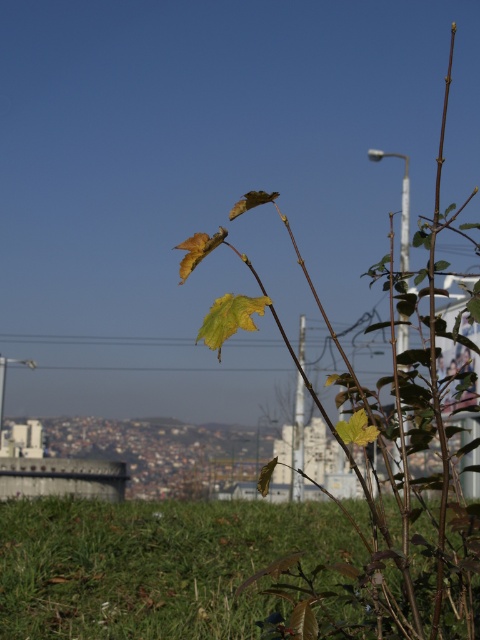
Question: Can you confirm if green grassy at lower left is wider than green matte leaf at center?

Choices:
 (A) yes
 (B) no

Answer: (B)

Question: Is green grassy at lower left smaller than green matte leaf at center?

Choices:
 (A) no
 (B) yes

Answer: (B)

Question: Is green grassy at lower left thinner than green matte leaf at center?

Choices:
 (A) yes
 (B) no

Answer: (A)

Question: Which point is closer to the camera?

Choices:
 (A) (377, 612)
 (B) (291, 580)

Answer: (A)

Question: Which point is closer to the camera taking this photo?

Choices:
 (A) (469, 545)
 (B) (84, 536)

Answer: (A)